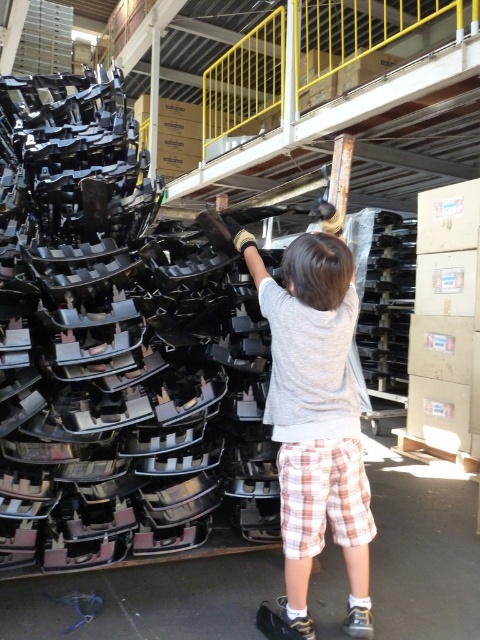
Based on the scene description, which object is wider, the white cotton shirt at center or the white textured shoe at lower center?

The white cotton shirt at center is wider than the white textured shoe at lower center according to the description.

You are a parent trying to choose between two shoes for your child based on their height. You see the white fabric shoe at lower center and the white textured shoe at lower center in the image. Which shoe is taller?

The white textured shoe at lower center is taller than the white fabric shoe at lower center.